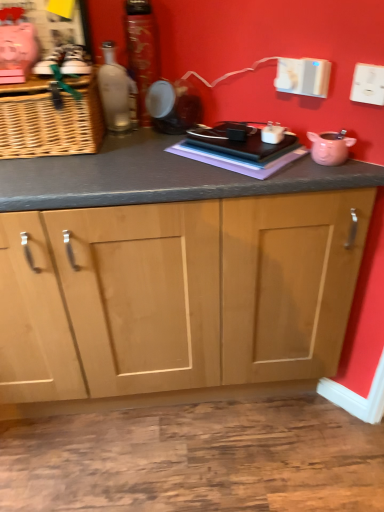
Question: Which direction should I rotate to face matte black speaker at center, placed as the second appliance when sorted from bottom to top, — up or down?

Choices:
 (A) down
 (B) up

Answer: (B)

Question: From a real-world perspective, is shiny metallic can at center, the 1th bottle when ordered from right to left, under matte black speaker at center, placed as the second appliance when sorted from bottom to top?

Choices:
 (A) yes
 (B) no

Answer: (B)

Question: Is shiny metallic can at center, which appears as the 2th bottle when viewed from the left, thinner than matte black speaker at center, placed as the second appliance when sorted from bottom to top?

Choices:
 (A) no
 (B) yes

Answer: (A)

Question: Does shiny metallic can at center, the 1th bottle when ordered from right to left, have a greater width compared to matte black speaker at center, placed as the second appliance when sorted from bottom to top?

Choices:
 (A) no
 (B) yes

Answer: (B)

Question: Can you confirm if shiny metallic can at center, the 1th bottle when ordered from right to left, is taller than matte black speaker at center, the 1th appliance when ordered from left to right?

Choices:
 (A) yes
 (B) no

Answer: (A)

Question: Can you confirm if shiny metallic can at center, the 1th bottle when ordered from right to left, is shorter than matte black speaker at center, the 1th appliance viewed from the back?

Choices:
 (A) yes
 (B) no

Answer: (B)

Question: Is shiny metallic can at center, which appears as the 2th bottle when viewed from the left, behind matte black speaker at center, the 1th appliance viewed from the back?

Choices:
 (A) no
 (B) yes

Answer: (B)

Question: From the image's perspective, would you say pink matte piggy bank at right, which appears as the 2th appliance when viewed from the back, is positioned over matte glass bottle at upper left, the 2th bottle viewed from the right?

Choices:
 (A) yes
 (B) no

Answer: (B)

Question: From the image's perspective, is pink matte piggy bank at right, the 1th appliance in the front-to-back sequence, under matte glass bottle at upper left, the 2th bottle viewed from the right?

Choices:
 (A) no
 (B) yes

Answer: (B)

Question: Does pink matte piggy bank at right, which appears as the 2th appliance when viewed from the back, appear on the right side of matte glass bottle at upper left, the 1th bottle from the left?

Choices:
 (A) no
 (B) yes

Answer: (B)

Question: Is pink matte piggy bank at right, which appears as the 2th appliance when viewed from the back, oriented away from matte glass bottle at upper left, the 1th bottle from the left?

Choices:
 (A) yes
 (B) no

Answer: (B)

Question: From a real-world perspective, is pink matte piggy bank at right, which is the first appliance from bottom to top, located higher than matte glass bottle at upper left, the 1th bottle from the left?

Choices:
 (A) yes
 (B) no

Answer: (B)

Question: Considering the relative positions of pink matte piggy bank at right, the 1th appliance in the front-to-back sequence, and matte glass bottle at upper left, the 1th bottle from the left, in the image provided, is pink matte piggy bank at right, the 1th appliance in the front-to-back sequence, behind matte glass bottle at upper left, the 1th bottle from the left,?

Choices:
 (A) no
 (B) yes

Answer: (A)

Question: Is the surface of matte glass bottle at upper left, the 2th bottle viewed from the right, in direct contact with woven brown basket at left?

Choices:
 (A) no
 (B) yes

Answer: (A)